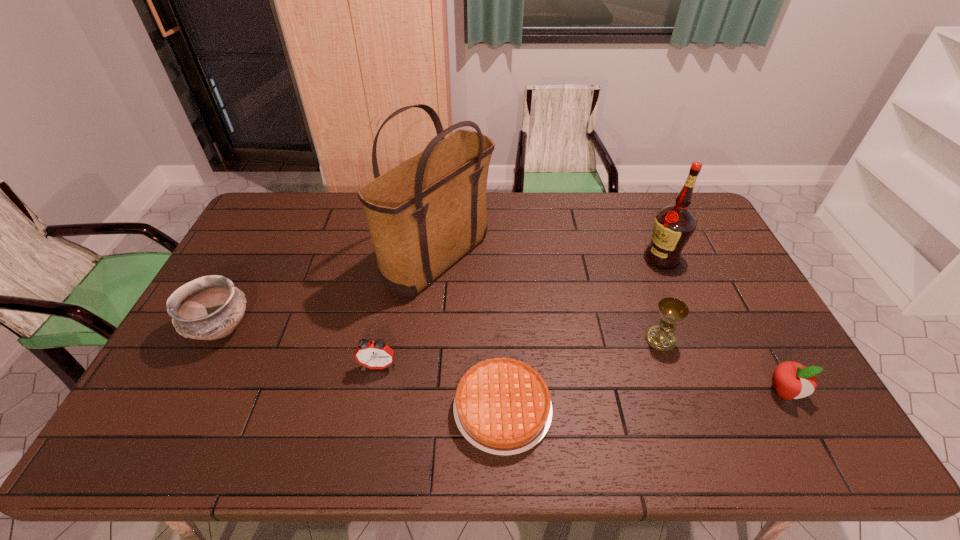
Where is `vacant space that's between the shortest object and the alarm clock`? vacant space that's between the shortest object and the alarm clock is located at coordinates (441, 387).

This screenshot has height=540, width=960. What are the coordinates of `vacant area that lies between the shortest object and the apple` in the screenshot? It's located at click(643, 400).

In order to click on vacant space that is in between the alarm clock and the chalice in this screenshot , I will do `click(519, 352)`.

Find the location of `free area in between the chalice and the shortest object`. free area in between the chalice and the shortest object is located at coordinates (582, 374).

Find the location of a particular element. Image resolution: width=960 pixels, height=540 pixels. object that is the fourth closest to the pottery is located at coordinates (672, 310).

At what (x,y) coordinates should I click in order to perform the action: click on the third closest object to the tote bag. Please return your answer as a coordinate pair (x, y). Looking at the image, I should click on (208, 308).

You are a GUI agent. You are given a task and a screenshot of the screen. Output one action in this format:
    pyautogui.click(x=<x>, y=<y>)
    Task: Click on the free space that satisfies the following two spatial constraints: 1. on the back side of the chalice; 2. on the right side of the pie
    
    Given the screenshot: What is the action you would take?
    pyautogui.click(x=500, y=339)

Image resolution: width=960 pixels, height=540 pixels. In order to click on vacant region that satisfies the following two spatial constraints: 1. on the front side of the tallest object; 2. on the right side of the shortest object in this screenshot , I will do `click(423, 409)`.

Locate an element on the screen. This screenshot has height=540, width=960. vacant space that satisfies the following two spatial constraints: 1. on the label of the alcohol; 2. on the clock face of the alarm clock is located at coordinates point(708,366).